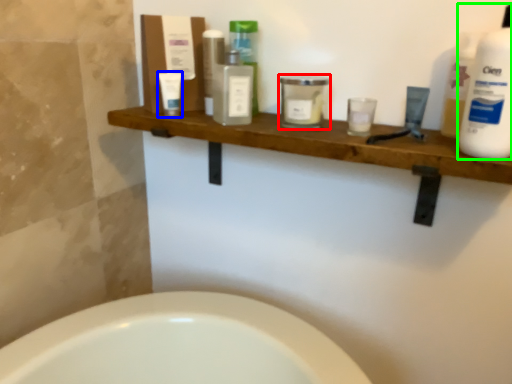
Question: Which object is positioned farthest from toiletry (highlighted by a red box)? Select from toiletry (highlighted by a blue box) and cleaning product (highlighted by a green box).

Choices:
 (A) toiletry
 (B) cleaning product

Answer: (B)